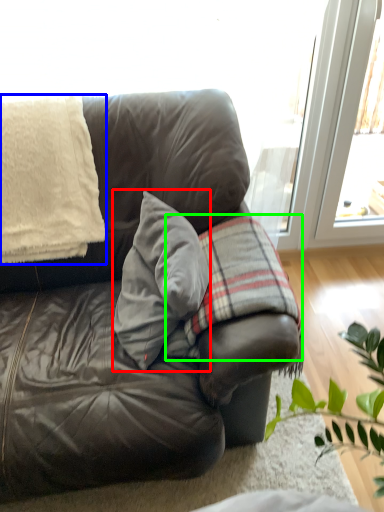
Question: Which object is positioned farthest from throw pillow (highlighted by a red box)? Select from blanket (highlighted by a blue box) and plaid (highlighted by a green box).

Choices:
 (A) blanket
 (B) plaid

Answer: (A)